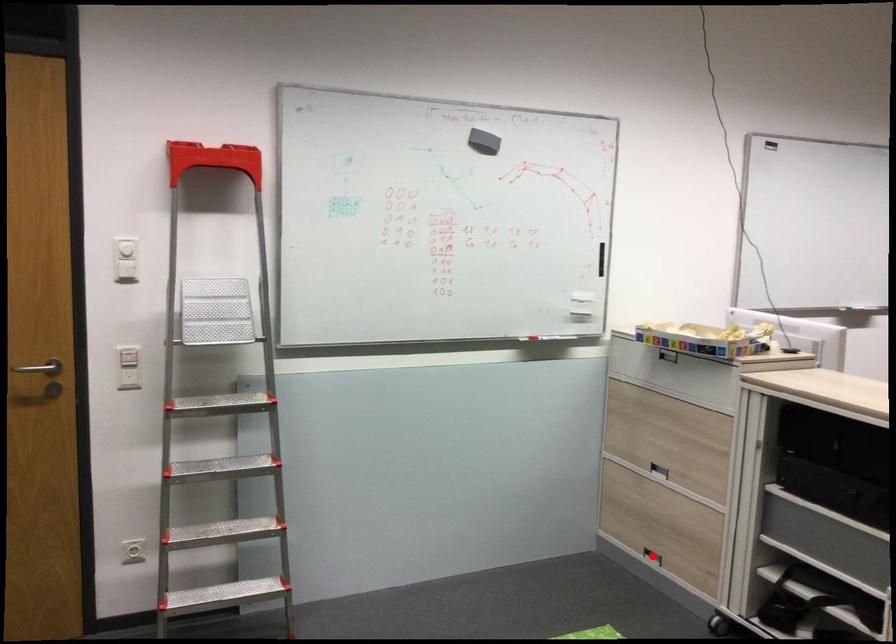
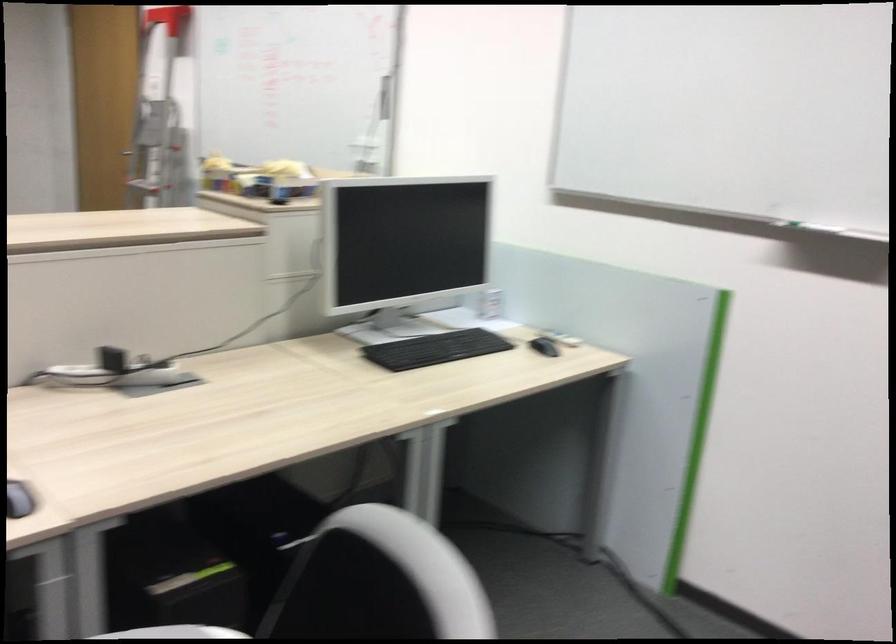
Question: I am providing you with two images of the same scene from different viewpoints. A red point is marked on the first image. Is the red point's position out of view in image 2?

Choices:
 (A) Yes
 (B) No

Answer: (A)